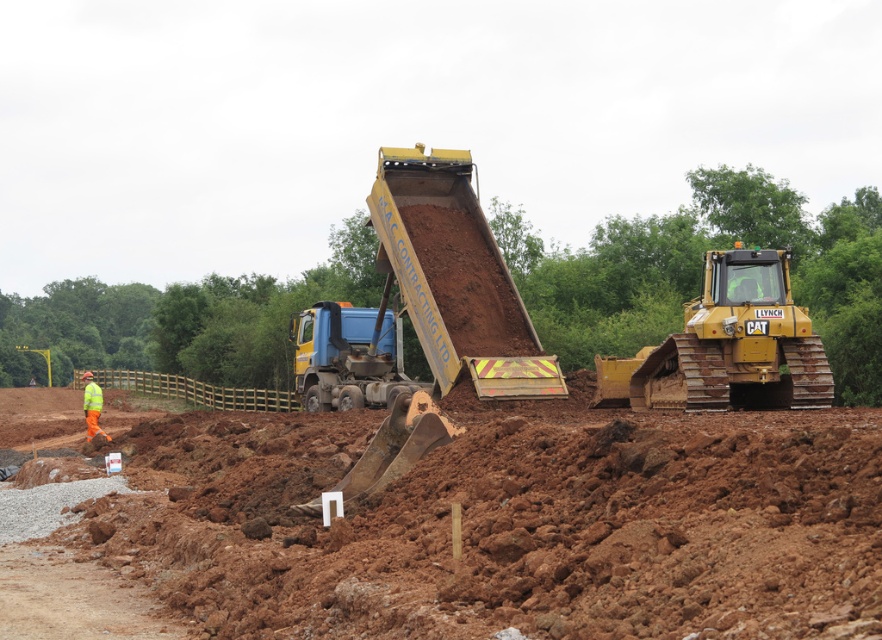
Question: Is yellow metallic tractor at center behind hi-viz reflective vest at lower left?

Choices:
 (A) yes
 (B) no

Answer: (B)

Question: Considering the relative positions of brown earth at center and hi-viz reflective vest at lower left in the image provided, where is brown earth at center located with respect to hi-viz reflective vest at lower left?

Choices:
 (A) left
 (B) right

Answer: (B)

Question: Which of the following is the farthest from the observer?

Choices:
 (A) (95, 387)
 (B) (729, 332)

Answer: (A)

Question: Among these points, which one is farthest from the camera?

Choices:
 (A) (387, 180)
 (B) (551, 538)
 (C) (84, 390)
 (D) (761, 276)

Answer: (C)

Question: Which point is farther to the camera?

Choices:
 (A) metallic yellow tractor at center
 (B) hi-viz reflective vest at lower left

Answer: (B)

Question: Observing the image, what is the correct spatial positioning of brown earth at center in reference to hi-viz reflective vest at lower left?

Choices:
 (A) left
 (B) right

Answer: (B)